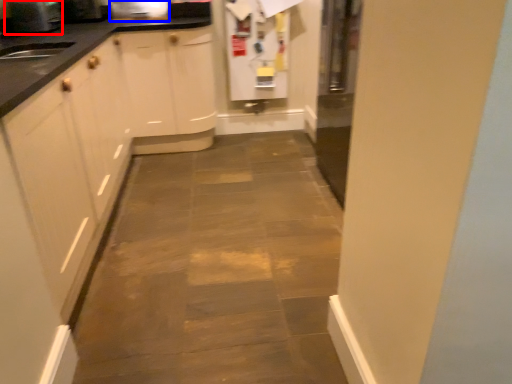
Question: Among these objects, which one is farthest to the camera, appliance (highlighted by a red box) or appliance (highlighted by a blue box)?

Choices:
 (A) appliance
 (B) appliance

Answer: (B)